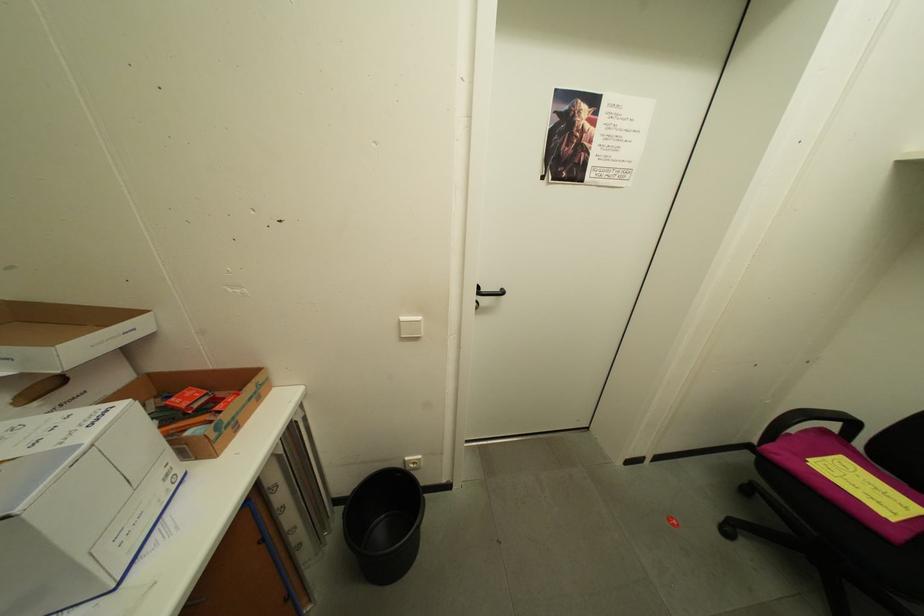
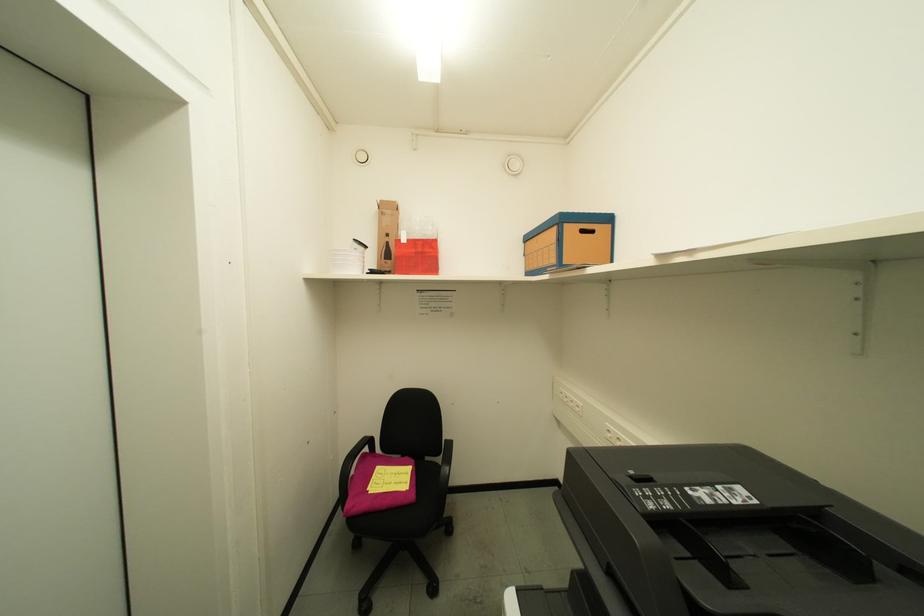
Question: The camera is either moving clockwise (left) or counter-clockwise (right) around the object. The first image is from the beginning of the video and the second image is from the end. Is the camera moving left or right when shooting the video?

Choices:
 (A) Left
 (B) Right

Answer: (A)